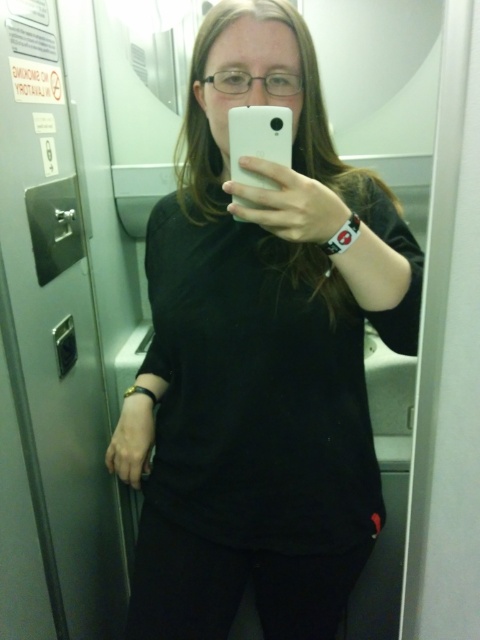
Can you confirm if black matte shirt at center is positioned above white matte phone at center?

Incorrect, black matte shirt at center is not positioned above white matte phone at center.

Identify the location of black matte shirt at center. (261, 355).

The image size is (480, 640). Describe the element at coordinates (261, 355) in the screenshot. I see `black matte shirt at center` at that location.

Locate an element on the screen. The image size is (480, 640). black matte shirt at center is located at coordinates (261, 355).